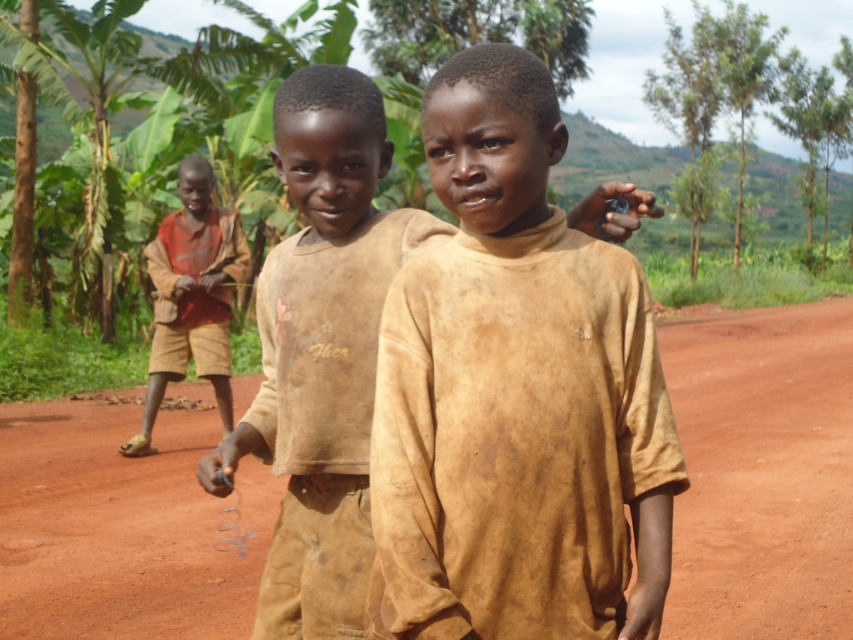
Question: Is brown matte shirt at center in front of brown cotton shirt at center?

Choices:
 (A) no
 (B) yes

Answer: (B)

Question: Can you confirm if brown dirt track at center is positioned above brown cotton shirt at center?

Choices:
 (A) yes
 (B) no

Answer: (B)

Question: Does brown matte shirt at center appear under brown dirt track at center?

Choices:
 (A) yes
 (B) no

Answer: (B)

Question: Among these points, which one is farthest from the camera?

Choices:
 (A) (380, 595)
 (B) (778, 349)

Answer: (B)

Question: Which point appears closest to the camera in this image?

Choices:
 (A) (286, 456)
 (B) (664, 557)

Answer: (B)

Question: Which point is farther to the camera?

Choices:
 (A) brown matte shirt at center
 (B) brown cotton shirt at center

Answer: (B)